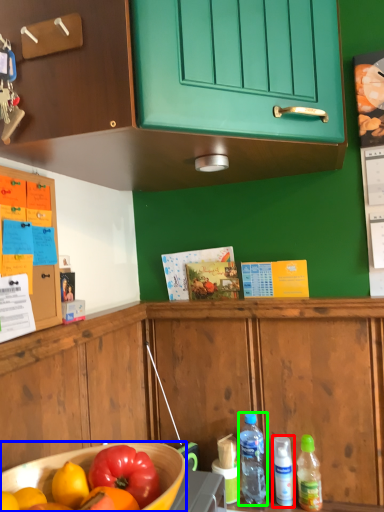
Question: Which object is the closest to the bottle (highlighted by a red box)? Choose among these: bowl (highlighted by a blue box) or bottle (highlighted by a green box).

Choices:
 (A) bowl
 (B) bottle

Answer: (B)